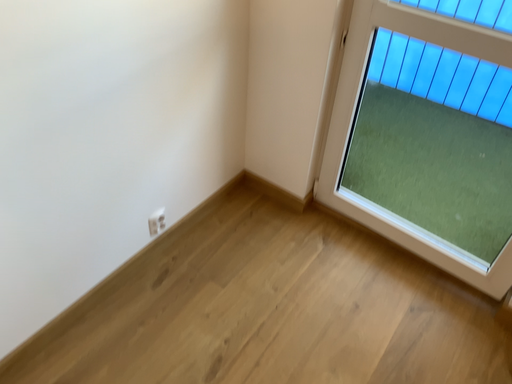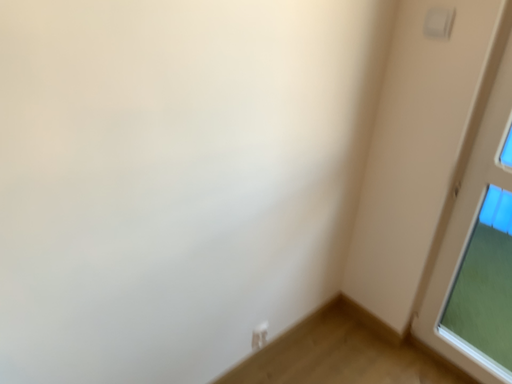
Question: How did the camera likely rotate when shooting the video?

Choices:
 (A) rotated left
 (B) rotated right

Answer: (A)